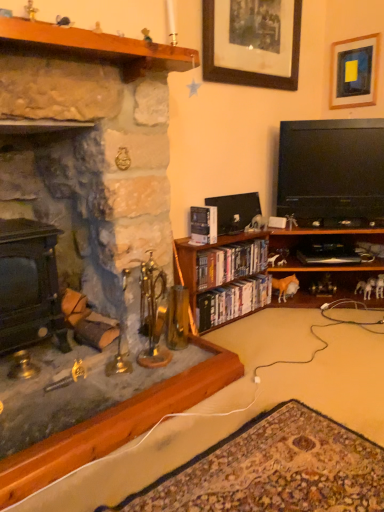
Question: From their relative heights in the image, would you say black glossy flat-screen tv at right is taller or shorter than wooden bookshelf at lower center?

Choices:
 (A) tall
 (B) short

Answer: (A)

Question: From the image's perspective, relative to wooden bookshelf at lower center, is black glossy flat-screen tv at right above or below?

Choices:
 (A) above
 (B) below

Answer: (A)

Question: Which object is positioned farthest from the hardcover books at center, arranged as the first book when ordered from the bottom?

Choices:
 (A) wooden at left
 (B) matte plastic books at center, acting as the second book starting from the bottom
 (C) matte black stove at left, arranged as the 2th fireplace when viewed from the right
 (D) wooden picture frame at upper right, which is counted as the first picture frame, starting from the right
 (E) wooden picture frame at upper center, the second picture frame from the right

Answer: (D)

Question: Based on their relative distances, which object is farther from the wooden bookshelf at lower center?

Choices:
 (A) hardcover book at center, which is the 1th book in top-to-bottom order
 (B) wooden picture frame at upper center, placed as the first picture frame when sorted from left to right
 (C) matte black stove at left, the first fireplace in the left-to-right sequence
 (D) matte plastic books at center, acting as the second book starting from the bottom
 (E) black glossy flat-screen tv at right

Answer: (C)